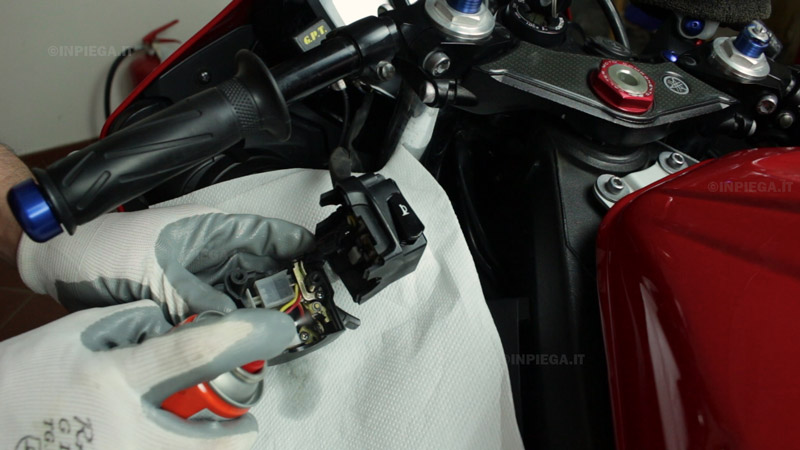
Where is `electronics`? The width and height of the screenshot is (800, 450). electronics is located at coordinates coord(290,298).